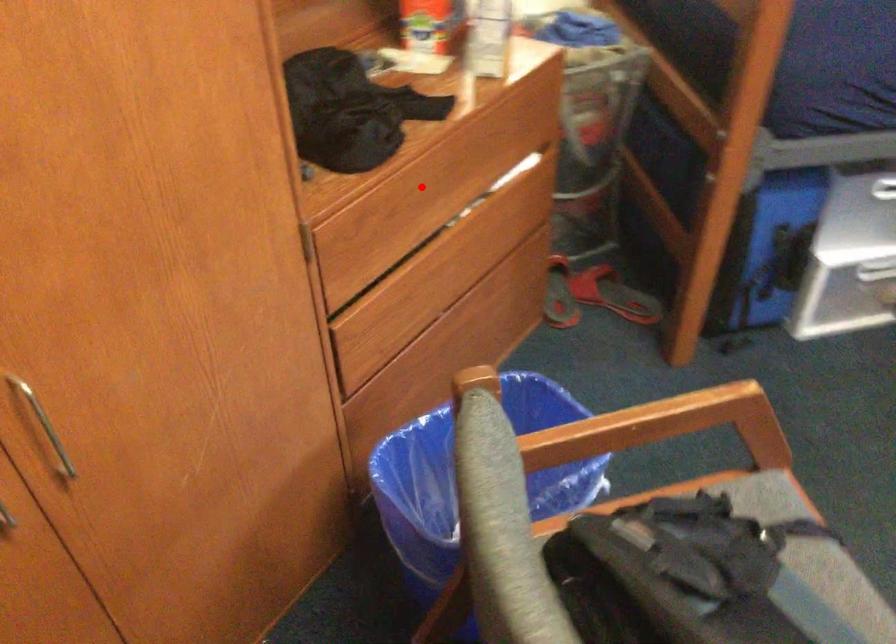
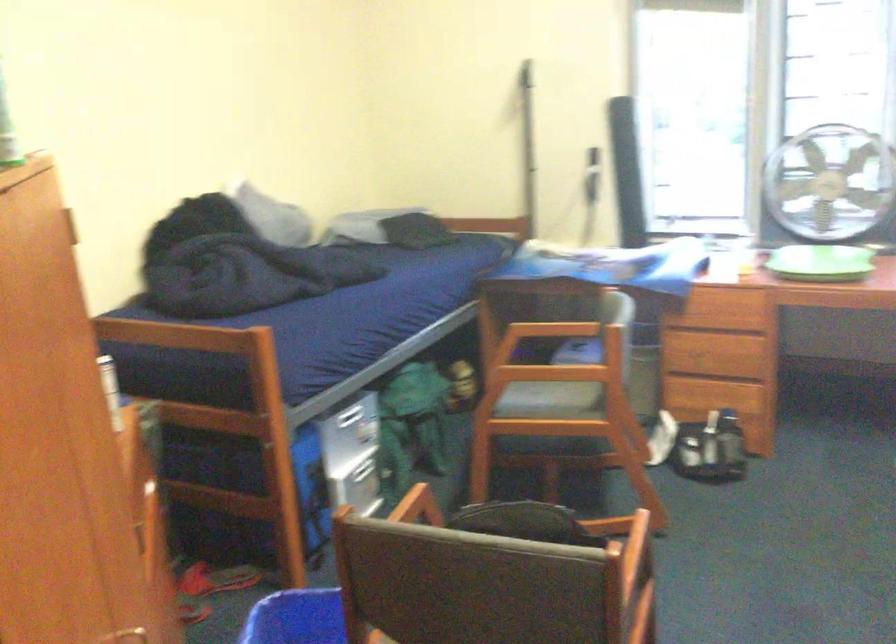
Question: I am providing you with two images of the same scene from different viewpoints. A red point is marked on the first image. Can you still see the location of the red point in image 2?

Choices:
 (A) Yes
 (B) No

Answer: (B)